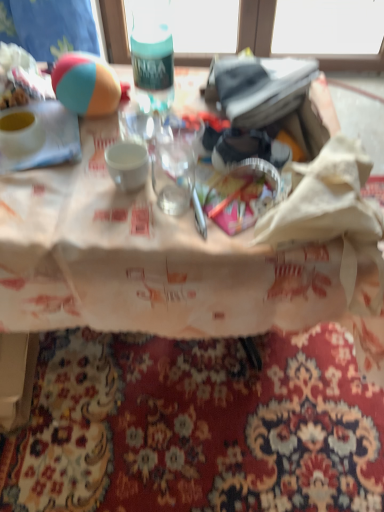
Measure the distance between point (76, 64) and camera.

The depth of point (76, 64) is 33.54 inches.

Describe the element at coordinates (20, 133) in the screenshot. The image size is (384, 512). I see `matte white bowl at upper left` at that location.

What do you see at coordinates (243, 195) in the screenshot? This screenshot has width=384, height=512. I see `translucent plastic cup at center` at bounding box center [243, 195].

The width and height of the screenshot is (384, 512). I want to click on tri-color rubber ball at upper left, so click(86, 84).

How distant is tri-color rubber ball at upper left from teal matte bottle at upper center?

4.10 inches.

Is point (107, 85) closer or farther from the camera than point (170, 49)?

Point (107, 85) is positioned closer to the camera compared to point (170, 49).

Between tri-color rubber ball at upper left and teal matte bottle at upper center, which one has larger size?

Bigger between the two is teal matte bottle at upper center.

Are tri-color rubber ball at upper left and teal matte bottle at upper center located far from each other?

That's not correct — tri-color rubber ball at upper left is a little close to teal matte bottle at upper center.

Where is `coffee cup on the left of teal matte bottle at upper center`? coffee cup on the left of teal matte bottle at upper center is located at coordinates point(20,133).

In the scene shown: From a real-world perspective, relative to teal matte bottle at upper center, is matte white bowl at upper left vertically above or below?

matte white bowl at upper left is situated lower than teal matte bottle at upper center in the real world.

Visually, is matte white bowl at upper left positioned to the left or to the right of teal matte bottle at upper center?

matte white bowl at upper left is positioned on teal matte bottle at upper center's left side.

Does point (12, 120) come farther from viewer compared to point (142, 67)?

That is False.

Based on the photo, measure the distance between matte white bowl at upper left and translucent plastic cup at center.

The distance of matte white bowl at upper left from translucent plastic cup at center is 16.19 inches.

Would you say matte white bowl at upper left is a long distance from translucent plastic cup at center?

That's not correct — matte white bowl at upper left is a little close to translucent plastic cup at center.

How different are the orientations of matte white bowl at upper left and translucent plastic cup at center in degrees?

The facing directions of matte white bowl at upper left and translucent plastic cup at center are 0.912 degrees apart.

Considering the relative sizes of matte white bowl at upper left and translucent plastic cup at center in the image provided, is matte white bowl at upper left shorter than translucent plastic cup at center?

No.

How far apart are translucent plastic cup at center and matte white bowl at upper left?

translucent plastic cup at center and matte white bowl at upper left are 16.19 inches apart.

Based on their sizes in the image, would you say translucent plastic cup at center is bigger or smaller than matte white bowl at upper left?

In the image, translucent plastic cup at center appears to be larger than matte white bowl at upper left.

In terms of width, does translucent plastic cup at center look wider or thinner when compared to matte white bowl at upper left?

Clearly, translucent plastic cup at center has less width compared to matte white bowl at upper left.

Looking at this image, is translucent plastic cup at center next to teal matte bottle at upper center and touching it?

No, translucent plastic cup at center is not beside teal matte bottle at upper center.

In terms of width, does translucent plastic cup at center look wider or thinner when compared to teal matte bottle at upper center?

Clearly, translucent plastic cup at center has more width compared to teal matte bottle at upper center.

Does translucent plastic cup at center appear on the right side of teal matte bottle at upper center?

Correct, you'll find translucent plastic cup at center to the right of teal matte bottle at upper center.

What's the angular difference between translucent plastic cup at center and teal matte bottle at upper center's facing directions?

The facing directions of translucent plastic cup at center and teal matte bottle at upper center are 1.98 degrees apart.

You are a GUI agent. You are given a task and a screenshot of the screen. Output one action in this format:
    pyautogui.click(x=<x>, y=<y>)
    Task: Click on the tableware in front of the tri-color rubber ball at upper left
    
    Given the screenshot: What is the action you would take?
    pyautogui.click(x=243, y=195)

Which object is thinner, translucent plastic cup at center or tri-color rubber ball at upper left?

With smaller width is tri-color rubber ball at upper left.

Is translucent plastic cup at center beside tri-color rubber ball at upper left?

No, translucent plastic cup at center is not with tri-color rubber ball at upper left.

From a real-world perspective, which object rests below the other?

From a 3D spatial view, translucent plastic cup at center is below.

Does point (149, 53) come farther from viewer compared to point (103, 106)?

No, it is in front of (103, 106).

Looking at this image, from the image's perspective, relative to tri-color rubber ball at upper left, is teal matte bottle at upper center above or below?

From the image's perspective, teal matte bottle at upper center appears above tri-color rubber ball at upper left.

Would you say teal matte bottle at upper center is to the left or to the right of tri-color rubber ball at upper left in the picture?

teal matte bottle at upper center is to the right of tri-color rubber ball at upper left.

Is teal matte bottle at upper center shorter than tri-color rubber ball at upper left?

In fact, teal matte bottle at upper center may be taller than tri-color rubber ball at upper left.

Locate an element on the screen. This screenshot has height=512, width=384. bottle above the tri-color rubber ball at upper left (from a real-world perspective) is located at coordinates (152, 60).

Locate an element on the screen. This screenshot has height=512, width=384. coffee cup behind the teal matte bottle at upper center is located at coordinates (20, 133).

Which object lies nearer to the anchor point matte white bowl at upper left, translucent plastic cup at center or tri-color rubber ball at upper left?

Based on the image, tri-color rubber ball at upper left appears to be nearer to matte white bowl at upper left.

Considering their positions, is tri-color rubber ball at upper left positioned closer to teal matte bottle at upper center than matte white bowl at upper left?

tri-color rubber ball at upper left lies closer to teal matte bottle at upper center than the other object.

Estimate the real-world distances between objects in this image. Which object is further from matte white bowl at upper left, tri-color rubber ball at upper left or teal matte bottle at upper center?

The object further to matte white bowl at upper left is teal matte bottle at upper center.

From the image, which object appears to be farther from matte white bowl at upper left, tri-color rubber ball at upper left or translucent plastic cup at center?

The object further to matte white bowl at upper left is translucent plastic cup at center.

Which object lies nearer to the anchor point tri-color rubber ball at upper left, teal matte bottle at upper center or translucent plastic cup at center?

teal matte bottle at upper center is positioned closer to the anchor tri-color rubber ball at upper left.

From the image, which object appears to be farther from teal matte bottle at upper center, translucent plastic cup at center or matte white bowl at upper left?

translucent plastic cup at center is further to teal matte bottle at upper center.

Looking at the image, which one is located closer to teal matte bottle at upper center, translucent plastic cup at center or tri-color rubber ball at upper left?

The object closer to teal matte bottle at upper center is tri-color rubber ball at upper left.

When comparing their distances from translucent plastic cup at center, does teal matte bottle at upper center or tri-color rubber ball at upper left seem closer?

teal matte bottle at upper center is closer to translucent plastic cup at center.

The width and height of the screenshot is (384, 512). In order to click on bottle between matte white bowl at upper left and translucent plastic cup at center from left to right in this screenshot , I will do `click(152, 60)`.

Where is `ball between teal matte bottle at upper center and translucent plastic cup at center in the vertical direction`? ball between teal matte bottle at upper center and translucent plastic cup at center in the vertical direction is located at coordinates (86, 84).

The image size is (384, 512). In order to click on ball between matte white bowl at upper left and teal matte bottle at upper center in this screenshot , I will do `click(86, 84)`.

Where is `ball situated between matte white bowl at upper left and translucent plastic cup at center from left to right`? Image resolution: width=384 pixels, height=512 pixels. ball situated between matte white bowl at upper left and translucent plastic cup at center from left to right is located at coordinates (86, 84).